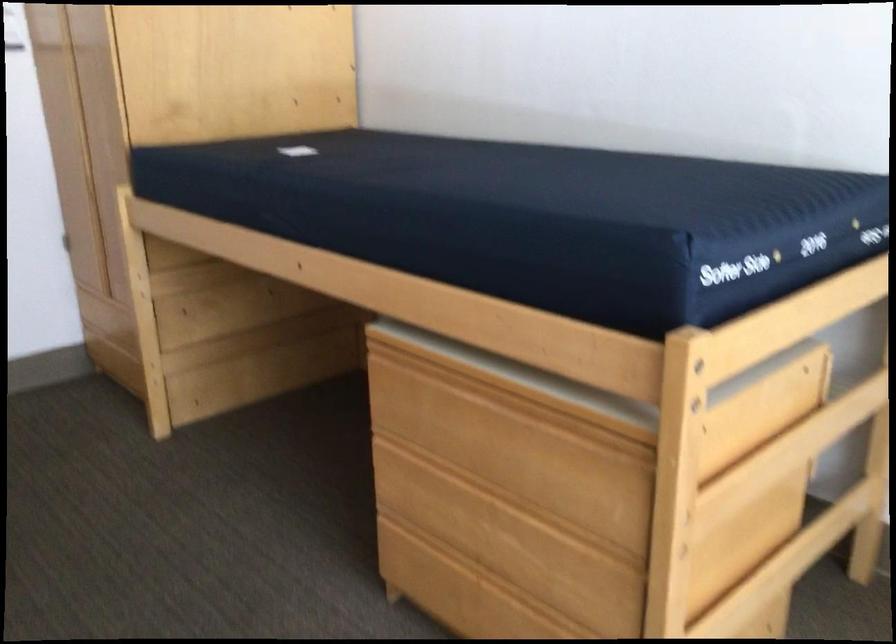
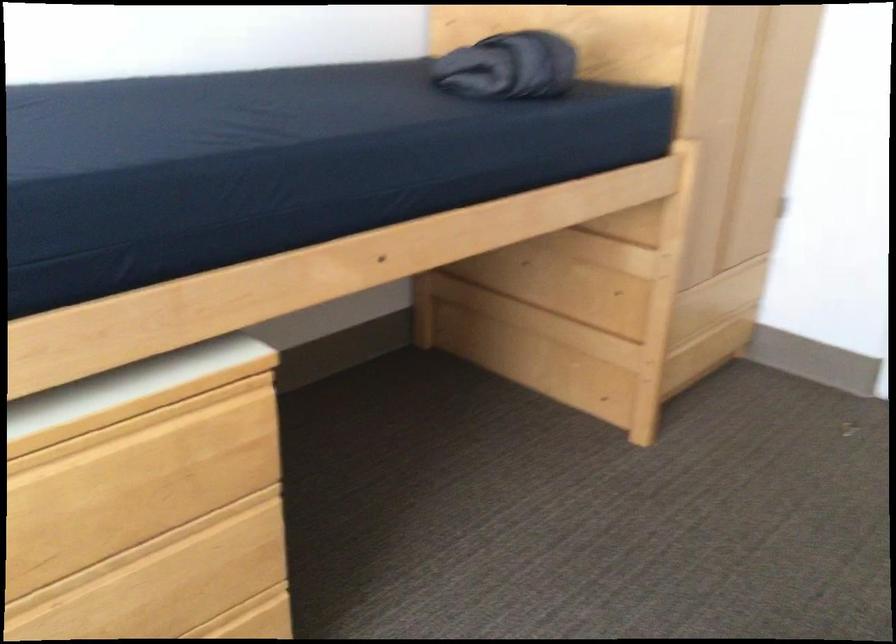
First-person continuous shooting, in which direction is the camera rotating?

The rotation direction of the camera is left-down.